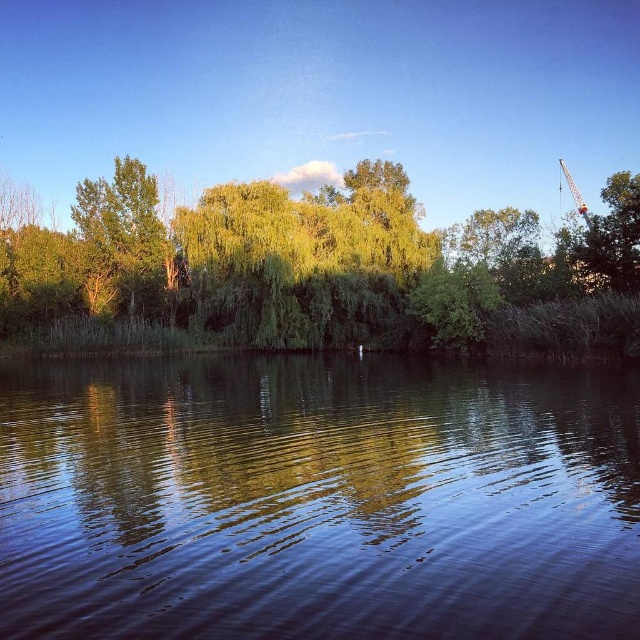
You are standing at the lakeside and want to take a photo of both the green leafy tree at left and the metallic yellow crane at upper right. Which object should you adjust your camera focus on first to ensure both are in the same frame?

You should focus on the green leafy tree at left first because it is closer to you than the metallic yellow crane at upper right, so adjusting focus on the closer object will help include both in the frame.

You are a photographer trying to capture the metallic yellow crane at upper right in your shot. However, you notice the smooth dark water at center might be blocking your view. Can you still see the crane clearly through the water?

The smooth dark water at center is in front of the metallic yellow crane at upper right, so the water is blocking the view of the crane. You cannot see the crane clearly through the water.

You are standing at the lakeside and want to know how far the point at coordinates (490, 378) is from you. Can you determine the distance?

The point at coordinates (490, 378) is 31.94 meters away from you.